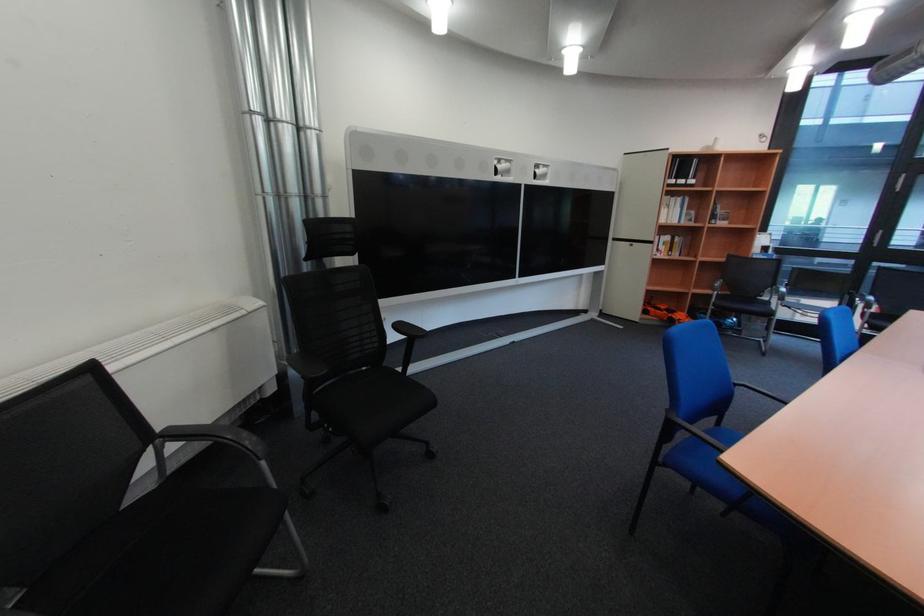
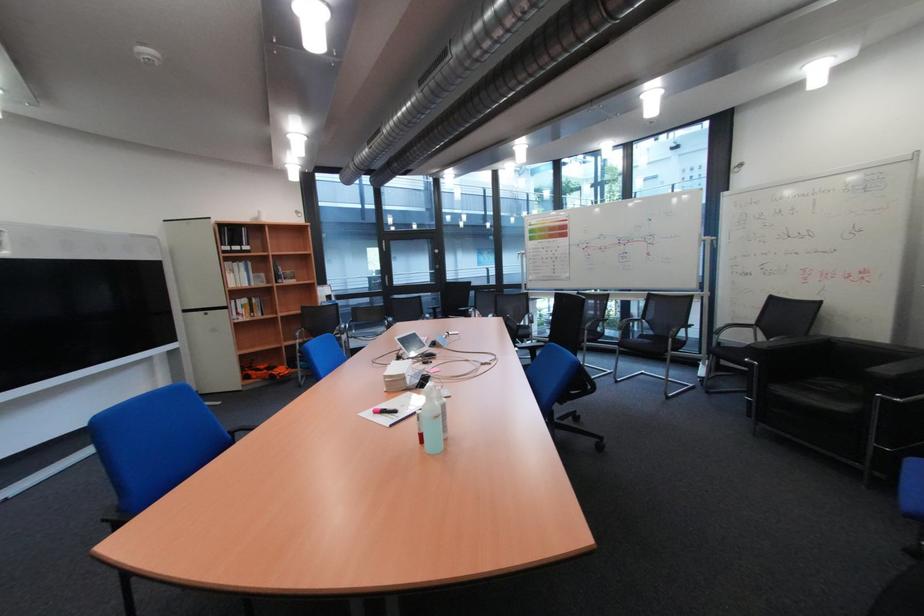
Question: The camera is either moving clockwise (left) or counter-clockwise (right) around the object. The first image is from the beginning of the video and the second image is from the end. Is the camera moving left or right when shooting the video?

Choices:
 (A) Left
 (B) Right

Answer: (A)